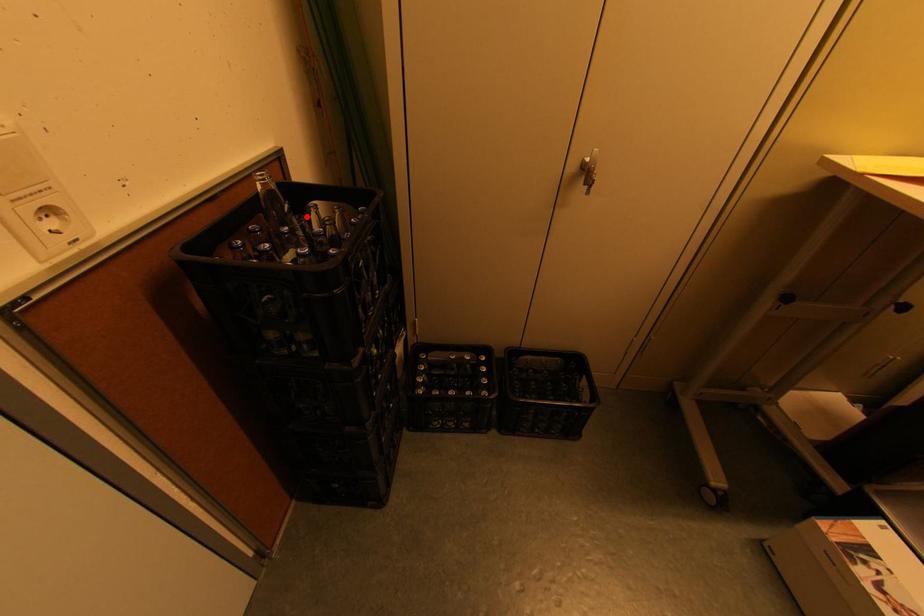
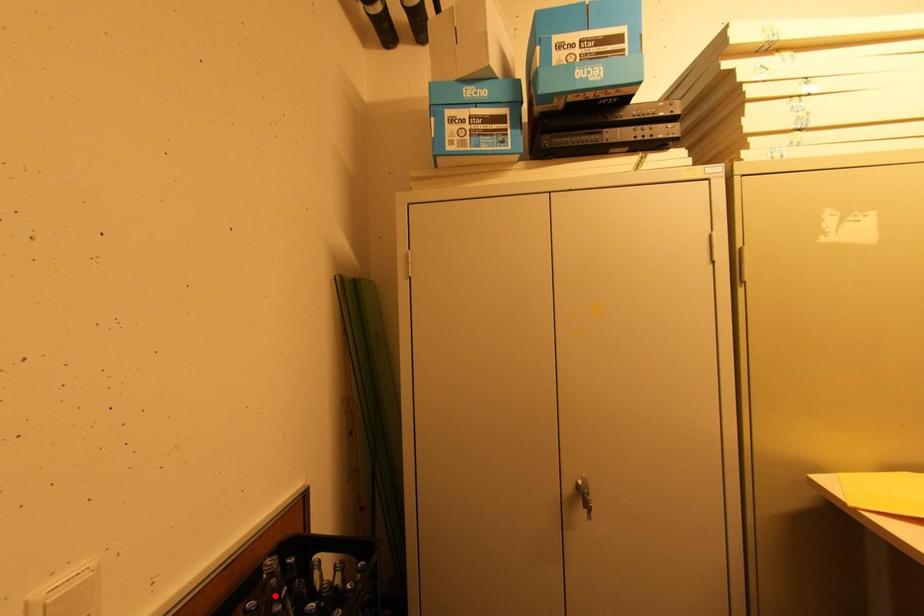
I am providing you with two images of the same scene from different viewpoints. A red point is marked on the first image and another point is marked on the second image. Do the highlighted points in image1 and image2 indicate the same real-world spot?

No